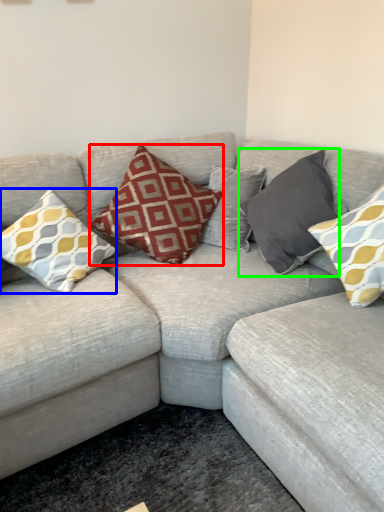
Question: Based on their relative distances, which object is nearer to pillow (highlighted by a red box)? Choose from pillow (highlighted by a blue box) and pillow (highlighted by a green box).

Choices:
 (A) pillow
 (B) pillow

Answer: (A)